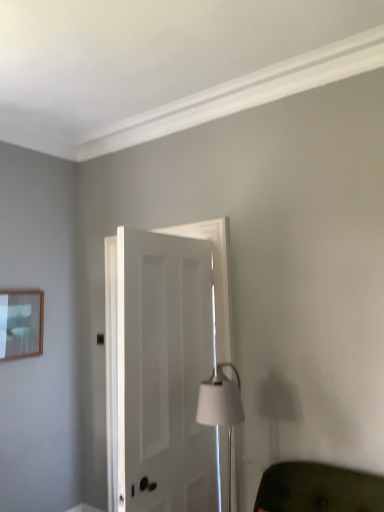
Question: Considering the relative positions of wooden picture frame at upper left and white matte door at center in the image provided, is wooden picture frame at upper left to the left or to the right of white matte door at center?

Choices:
 (A) right
 (B) left

Answer: (B)

Question: Considering the positions of wooden picture frame at upper left and white matte door at center in the image, is wooden picture frame at upper left bigger or smaller than white matte door at center?

Choices:
 (A) big
 (B) small

Answer: (B)

Question: Which object is the closest to the white matte door at center?

Choices:
 (A) white matte table lamp at center
 (B) green fabric couch at lower right
 (C) wooden picture frame at upper left

Answer: (A)

Question: Based on their relative distances, which object is nearer to the wooden picture frame at upper left?

Choices:
 (A) white matte table lamp at center
 (B) green fabric couch at lower right
 (C) white matte door at center

Answer: (C)